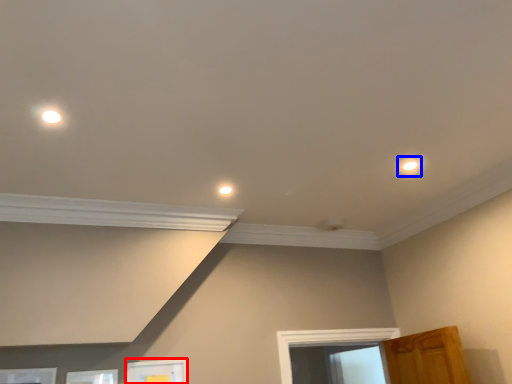
Question: Which object appears closest to the camera in this image, picture frame (highlighted by a red box) or dot (highlighted by a blue box)?

Choices:
 (A) picture frame
 (B) dot

Answer: (B)